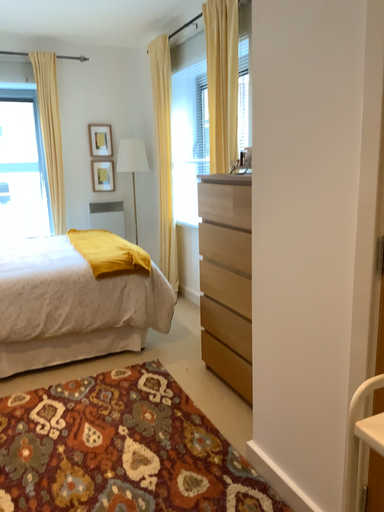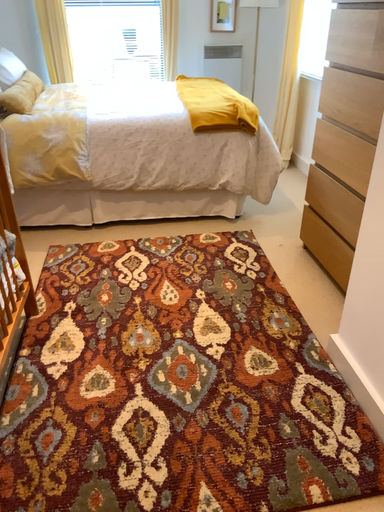
Question: How did the camera likely rotate when shooting the video?

Choices:
 (A) rotated right
 (B) rotated left

Answer: (B)